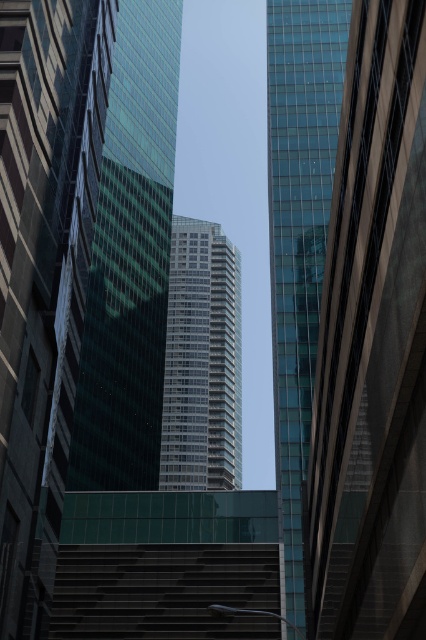
You are standing at the base of the dark gray concrete stairs at lower center and want to walk towards the glassy reflective skyscraper at right. Is the skyscraper directly above your current position?

The glassy reflective skyscraper at right is positioned over the dark gray concrete stairs at lower center, so yes, it is directly above your current position.

You are a drone operator tasked with flying a drone between the green glass building at center and the transparent glass building at center. The drone has a wingspan of 1.5 meters. Based on the scene, can the drone safely pass through the gap between them?

The green glass building at center and transparent glass building at center are 35.93 meters apart from each other. Since the drone has a wingspan of only 1.5 meters, there is more than enough space for it to safely pass through the gap between them.

You are standing at the base of the glassy reflective skyscraper at right and want to look up to the point at point (373, 342). Is this point located on the glassy reflective skyscraper at right?

Yes, the point at point (373, 342) is located on the glassy reflective skyscraper at right as stated in the objects description.